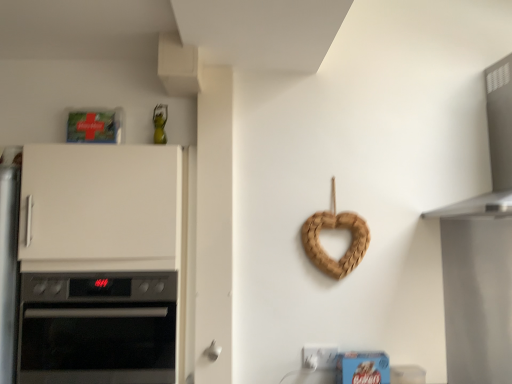
Question: Considering the relative sizes of black glass oven at left and braided wood heart at center-right in the image provided, is black glass oven at left smaller than braided wood heart at center-right?

Choices:
 (A) yes
 (B) no

Answer: (B)

Question: Considering the relative positions of black glass oven at left and braided wood heart at center-right in the image provided, is black glass oven at left to the right of braided wood heart at center-right from the viewer's perspective?

Choices:
 (A) yes
 (B) no

Answer: (B)

Question: From the image's perspective, would you say black glass oven at left is positioned over braided wood heart at center-right?

Choices:
 (A) no
 (B) yes

Answer: (A)

Question: Is black glass oven at left thinner than braided wood heart at center-right?

Choices:
 (A) no
 (B) yes

Answer: (A)

Question: Is black glass oven at left outside of braided wood heart at center-right?

Choices:
 (A) no
 (B) yes

Answer: (B)

Question: Is white matte door handle at lower center inside or outside of satin silver vent at upper right?

Choices:
 (A) inside
 (B) outside

Answer: (B)

Question: In the image, is white matte door handle at lower center on the left side or the right side of satin silver vent at upper right?

Choices:
 (A) left
 (B) right

Answer: (A)

Question: In terms of height, does white matte door handle at lower center look taller or shorter compared to satin silver vent at upper right?

Choices:
 (A) tall
 (B) short

Answer: (B)

Question: From a real-world perspective, is white matte door handle at lower center physically located above or below satin silver vent at upper right?

Choices:
 (A) above
 (B) below

Answer: (B)

Question: Is white matte cabinet at left in front of or behind satin silver vent at upper right in the image?

Choices:
 (A) behind
 (B) front

Answer: (A)

Question: In the image, is white matte cabinet at left on the left side or the right side of satin silver vent at upper right?

Choices:
 (A) left
 (B) right

Answer: (A)

Question: Does point (138, 226) appear closer or farther from the camera than point (488, 193)?

Choices:
 (A) farther
 (B) closer

Answer: (B)

Question: Choose the correct answer: Is white matte cabinet at left inside satin silver vent at upper right or outside it?

Choices:
 (A) inside
 (B) outside

Answer: (B)

Question: Considering the positions of braided wood heart at center-right and white matte cabinet at left in the image, is braided wood heart at center-right wider or thinner than white matte cabinet at left?

Choices:
 (A) thin
 (B) wide

Answer: (A)

Question: Relative to white matte cabinet at left, is braided wood heart at center-right in front or behind?

Choices:
 (A) front
 (B) behind

Answer: (B)